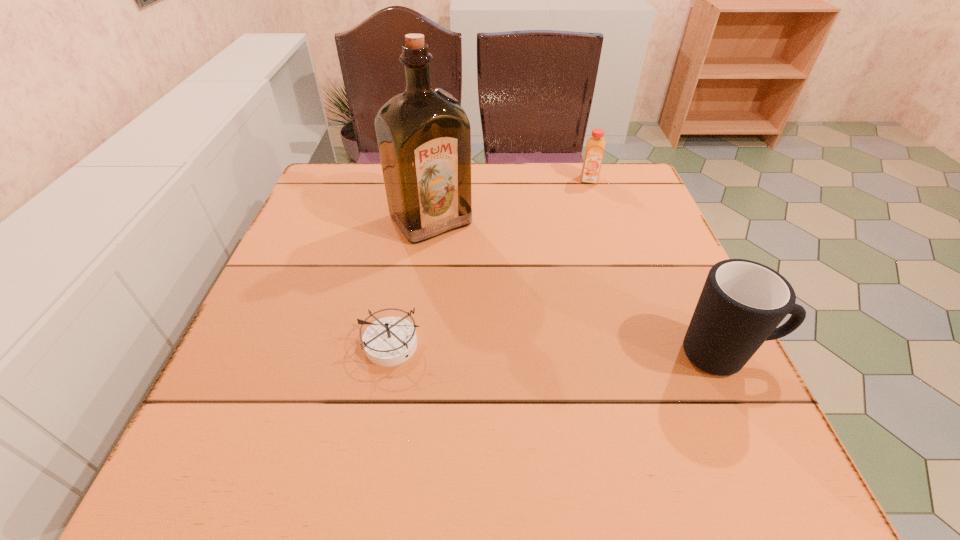
This screenshot has height=540, width=960. In order to click on vacant area between the compass and the rightmost object in this screenshot , I will do `click(560, 349)`.

Image resolution: width=960 pixels, height=540 pixels. I want to click on vacant area between the shortest object and the tallest object, so click(412, 282).

In order to click on vacant point located between the tallest object and the third tallest object in this screenshot , I will do [510, 200].

The width and height of the screenshot is (960, 540). I want to click on free point between the mug and the third tallest object, so click(x=658, y=267).

In order to click on vacant space that is in between the mug and the compass in this screenshot , I will do `click(560, 349)`.

Find the location of a particular element. vacant space that is in between the tallest object and the third shortest object is located at coordinates (579, 287).

Where is `free point between the mug and the farthest object`? free point between the mug and the farthest object is located at coordinates (658, 267).

Identify which object is the closest to the second object from right to left. Please provide its 2D coordinates. Your answer should be formatted as a tuple, i.e. [(x, y)], where the tuple contains the x and y coordinates of a point satisfying the conditions above.

[(424, 137)]

Identify which object is the third nearest to the third tallest object. Please provide its 2D coordinates. Your answer should be formatted as a tuple, i.e. [(x, y)], where the tuple contains the x and y coordinates of a point satisfying the conditions above.

[(389, 341)]

You are a GUI agent. You are given a task and a screenshot of the screen. Output one action in this format:
    pyautogui.click(x=<x>, y=<y>)
    Task: Click on the free location that satisfies the following two spatial constraints: 1. on the front side of the tallest object; 2. on the side of the third shortest object with the handle
    This screenshot has height=540, width=960.
    Given the screenshot: What is the action you would take?
    pyautogui.click(x=413, y=355)